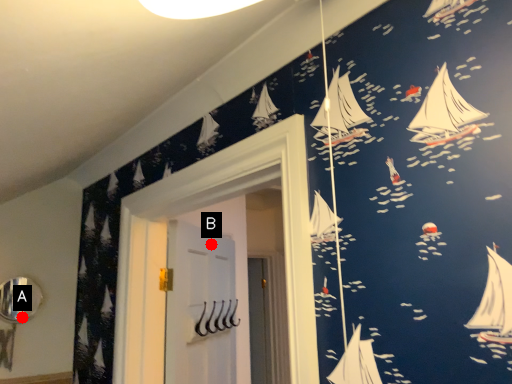
Question: Two points are circled on the image, labeled by A and B beside each circle. Which point appears farthest from the camera in this image?

Choices:
 (A) A is further
 (B) B is further

Answer: (B)